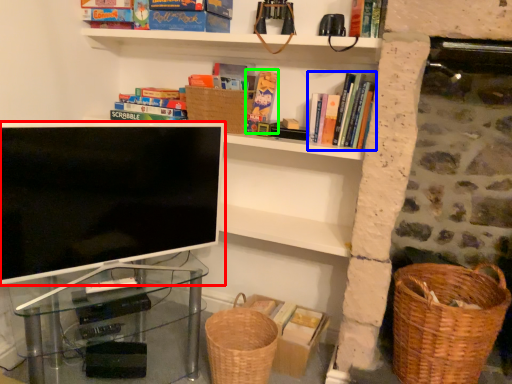
Question: Considering the real-world distances, which object is closest to television (highlighted by a red box)? book (highlighted by a blue box) or book (highlighted by a green box).

Choices:
 (A) book
 (B) book

Answer: (B)